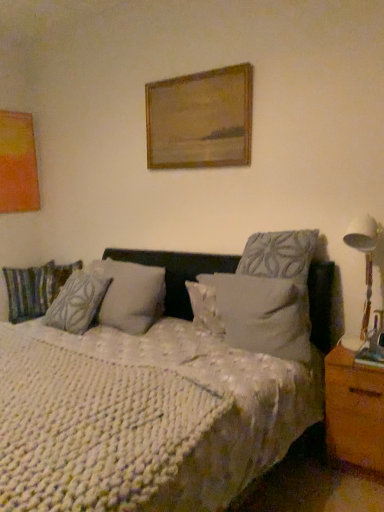
Locate an element on the screen. empty space that is ontop of wooden framed painting at upper center is located at coordinates (188, 77).